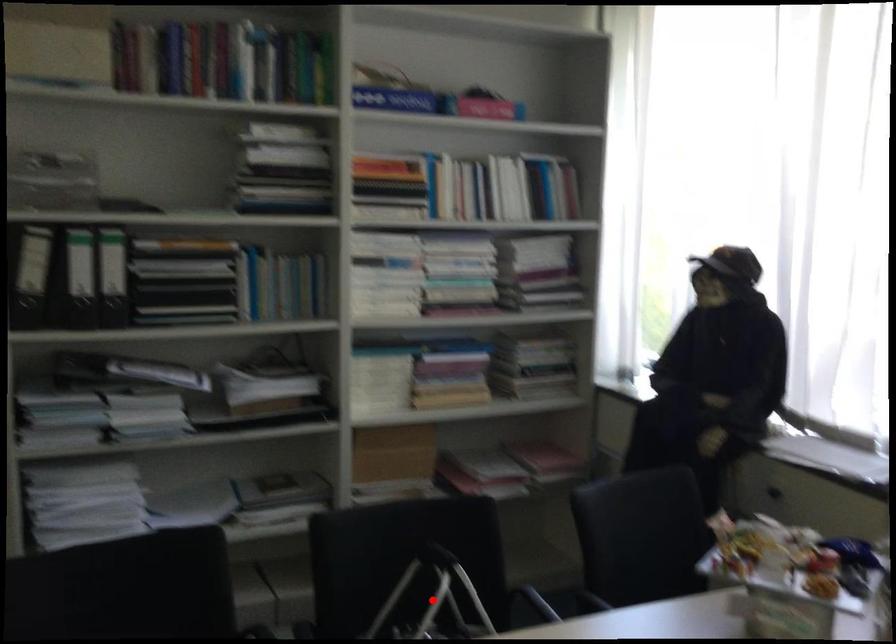
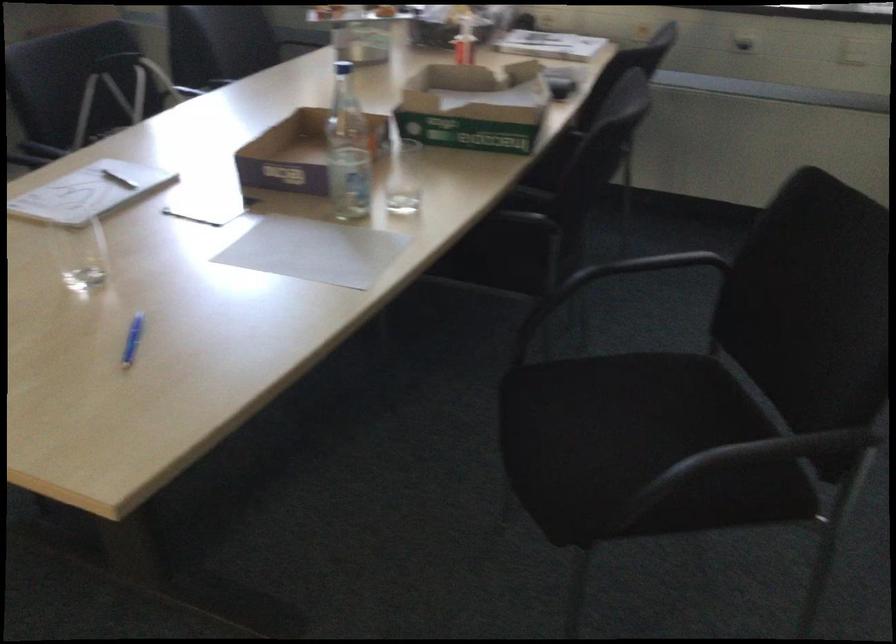
Question: I am providing you with two images of the same scene from different viewpoints. A red point is marked on the first image. At the location where the point appears in image 1, is it still visible in image 2?

Choices:
 (A) Yes
 (B) No

Answer: (B)